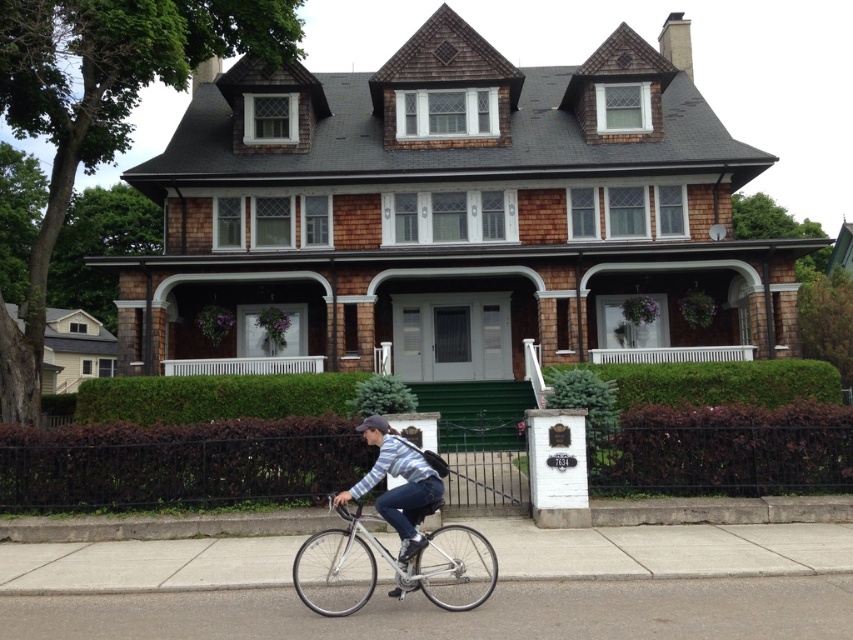
You are a delivery person trying to park your silver metallic bicycle at lower center near the entrance of the house. However, there is a striped cotton shirt at center hanging from a clothesline between two trees. Can the bicycle be parked there without hitting the shirt?

The silver metallic bicycle at lower center might be wider than striped cotton shirt at center, so there is a possibility that parking the bicycle there could hit the shirt if they are positioned in a way that their widths overlap.

You are standing in front of the house and see the point marked as point (389, 564). What object is located at that point?

The silver metallic bicycle at lower center is located at point (389, 564).

You are standing at the entrance of the house and want to park your silver metallic bicycle at lower center. Based on the image, where should you place it to ensure it is near the entrance?

The silver metallic bicycle at lower center is located at point (389,564), so you should place it near that coordinate to ensure it is near the entrance.